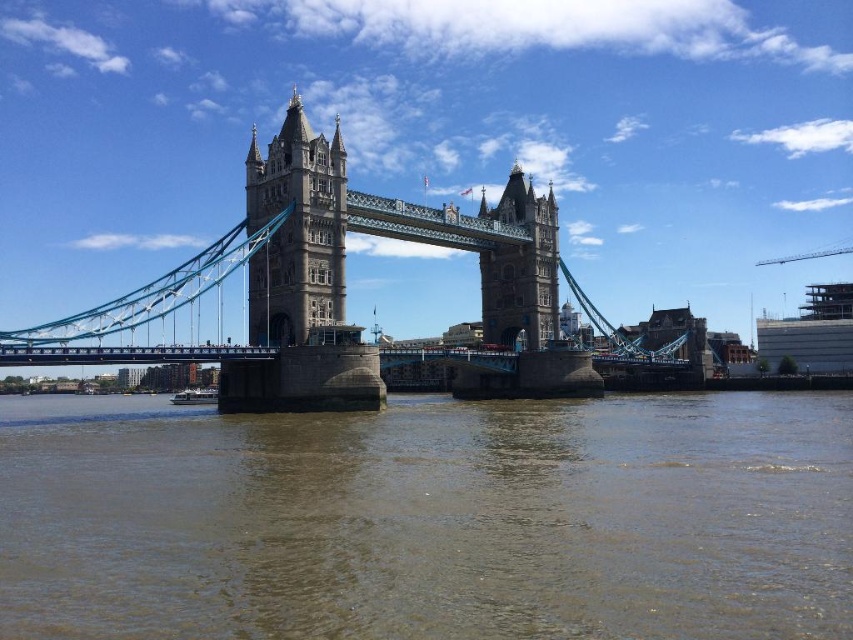
Does brown sedimentary water at center have a greater height compared to stone stonework tower at center?

No.

Is the position of brown sedimentary water at center less distant than that of stone stonework tower at center?

Yes.

You are a GUI agent. You are given a task and a screenshot of the screen. Output one action in this format:
    pyautogui.click(x=<x>, y=<y>)
    Task: Click on the brown sedimentary water at center
    
    Given the screenshot: What is the action you would take?
    pyautogui.click(x=428, y=518)

Is blue metallic suspension bridge at center thinner than brown stone tower at center?

In fact, blue metallic suspension bridge at center might be wider than brown stone tower at center.

Who is more distant from viewer, (537, 282) or (480, 285)?

The point (480, 285) is more distant.

At what (x,y) coordinates should I click in order to perform the action: click on blue metallic suspension bridge at center. Please return your answer as a coordinate pair (x, y). The height and width of the screenshot is (640, 853). Looking at the image, I should click on (343, 272).

Who is more distant from viewer, (326, 209) or (512, 186)?

The point (512, 186) is more distant.

Between stone stonework tower at center and brown stone tower at center, which one has less height?

Standing shorter between the two is brown stone tower at center.

Between point (274, 241) and point (550, 330), which one is positioned behind?

Positioned behind is point (550, 330).

The width and height of the screenshot is (853, 640). I want to click on stone stonework tower at center, so click(296, 230).